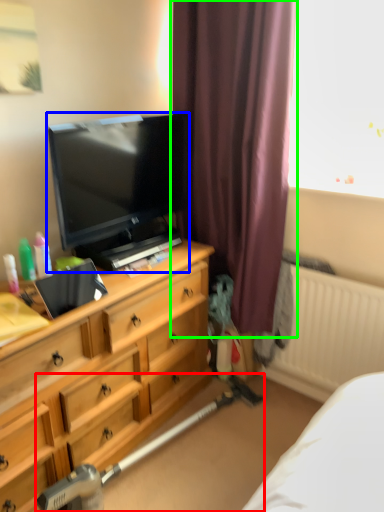
Question: Which object is positioned closest to equipment (highlighted by a red box)? Select from television (highlighted by a blue box) and curtain (highlighted by a green box).

Choices:
 (A) television
 (B) curtain

Answer: (A)